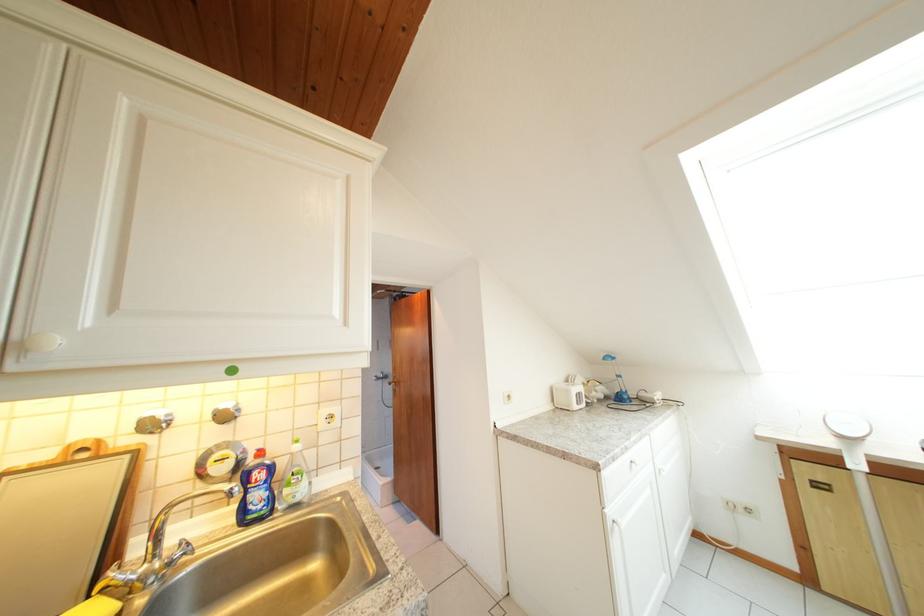
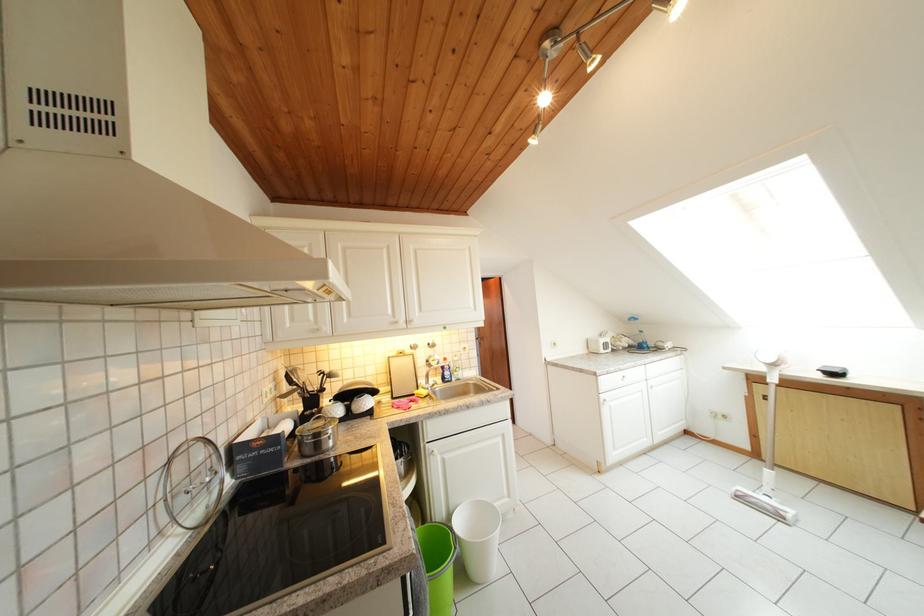
The point at (817, 585) is marked in the first image. Where is the corresponding point in the second image?

(764, 460)